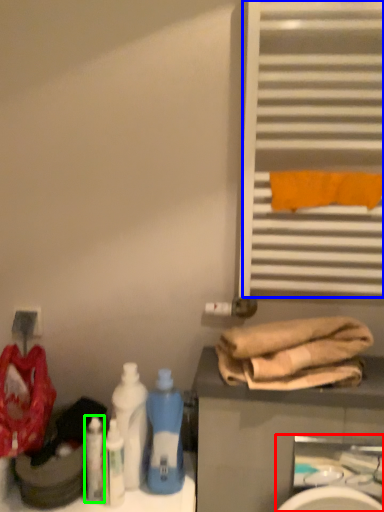
Question: Based on their relative distances, which object is nearer to sink (highlighted by a red box)? Choose from shutter (highlighted by a blue box) and cleaning product (highlighted by a green box).

Choices:
 (A) shutter
 (B) cleaning product

Answer: (A)